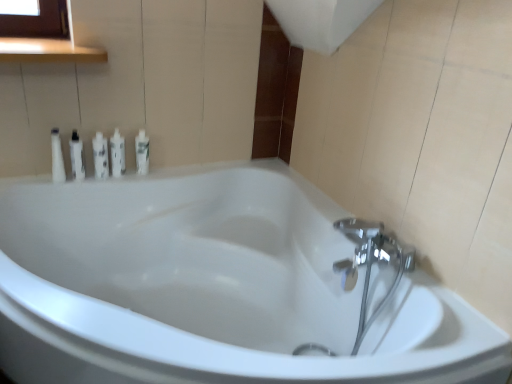
Question: Is white glossy bottle at upper left, which is counted as the fifth toiletry, starting from the left, located within white glossy bottle at upper left, which is the 4th toiletry from left to right?

Choices:
 (A) yes
 (B) no

Answer: (B)

Question: Is white glossy bottle at upper left, the 2th toiletry viewed from the right, placed right next to white glossy bottle at upper left, positioned as the first toiletry in right-to-left order?

Choices:
 (A) no
 (B) yes

Answer: (B)

Question: From a real-world perspective, is white glossy bottle at upper left, the 2th toiletry viewed from the right, located higher than white glossy bottle at upper left, which is counted as the fifth toiletry, starting from the left?

Choices:
 (A) no
 (B) yes

Answer: (B)

Question: Is white glossy bottle at upper left, the 2th toiletry viewed from the right, turned away from white glossy bottle at upper left, positioned as the first toiletry in right-to-left order?

Choices:
 (A) yes
 (B) no

Answer: (B)

Question: Can you confirm if white glossy bottle at upper left, which is the 4th toiletry from left to right, is wider than white glossy bottle at upper left, positioned as the first toiletry in right-to-left order?

Choices:
 (A) no
 (B) yes

Answer: (A)

Question: Considering the positions of white glossy bottle at upper left, the 2th toiletry viewed from the right, and white glossy tube at upper left, the fourth toiletry in the right-to-left sequence, in the image, is white glossy bottle at upper left, the 2th toiletry viewed from the right, taller or shorter than white glossy tube at upper left, the fourth toiletry in the right-to-left sequence,?

Choices:
 (A) short
 (B) tall

Answer: (B)

Question: Is white glossy bottle at upper left, which is the 4th toiletry from left to right, situated inside white glossy tube at upper left, positioned as the 2th toiletry in left-to-right order, or outside?

Choices:
 (A) outside
 (B) inside

Answer: (A)

Question: Relative to white glossy tube at upper left, the fourth toiletry in the right-to-left sequence, is white glossy bottle at upper left, the 2th toiletry viewed from the right, in front or behind?

Choices:
 (A) behind
 (B) front

Answer: (A)

Question: Would you say white glossy bottle at upper left, the 2th toiletry viewed from the right, is to the left or to the right of white glossy tube at upper left, the fourth toiletry in the right-to-left sequence, in the picture?

Choices:
 (A) right
 (B) left

Answer: (A)

Question: Is white glossy lotion at center, which ranks as the 3th toiletry in left-to-right order, to the left or to the right of white glossy bottle at left, which ranks as the fifth toiletry in right-to-left order, in the image?

Choices:
 (A) right
 (B) left

Answer: (A)

Question: Is white glossy lotion at center, which ranks as the 3th toiletry in left-to-right order, inside the boundaries of white glossy bottle at left, which ranks as the fifth toiletry in right-to-left order, or outside?

Choices:
 (A) inside
 (B) outside

Answer: (B)

Question: Is white glossy lotion at center, acting as the third toiletry starting from the right, taller or shorter than white glossy bottle at left, which ranks as the fifth toiletry in right-to-left order?

Choices:
 (A) short
 (B) tall

Answer: (A)

Question: Based on their sizes in the image, would you say white glossy lotion at center, which ranks as the 3th toiletry in left-to-right order, is bigger or smaller than white glossy bottle at left, the first toiletry positioned from the left?

Choices:
 (A) small
 (B) big

Answer: (A)

Question: Is white glossy bottle at left, which ranks as the fifth toiletry in right-to-left order, inside or outside of white glossy tube at upper left, positioned as the 2th toiletry in left-to-right order?

Choices:
 (A) outside
 (B) inside

Answer: (A)

Question: From the image's perspective, relative to white glossy tube at upper left, positioned as the 2th toiletry in left-to-right order, is white glossy bottle at left, which ranks as the fifth toiletry in right-to-left order, above or below?

Choices:
 (A) above
 (B) below

Answer: (B)